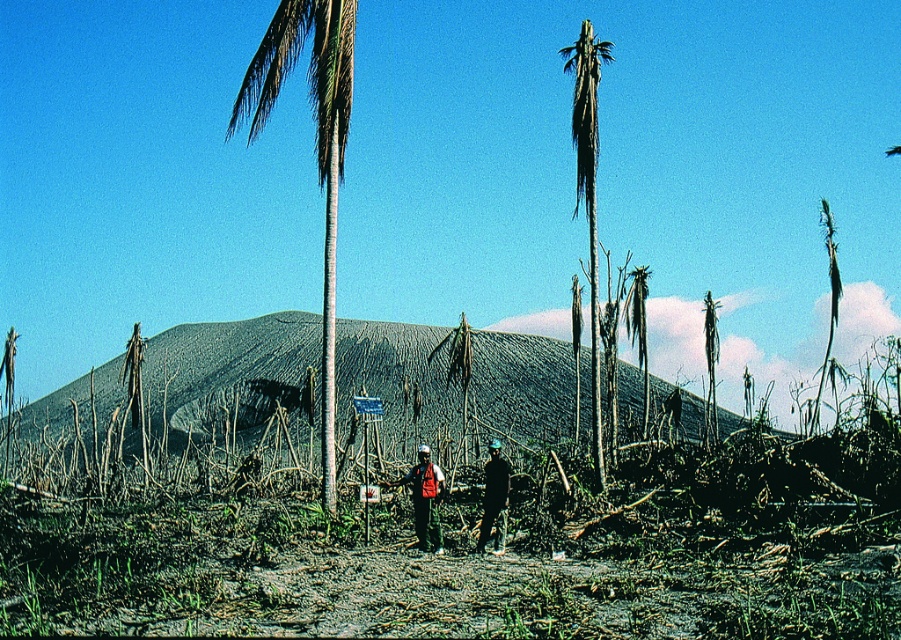
What do you see at coordinates (315, 145) in the screenshot?
I see `white smooth palm tree at center` at bounding box center [315, 145].

Is white smooth palm tree at center to the right of dark blue fabric at center from the viewer's perspective?

In fact, white smooth palm tree at center is to the left of dark blue fabric at center.

Who is more forward, (271, 40) or (487, 509)?

Point (487, 509) is more forward.

Identify the location of white smooth palm tree at center. (315, 145).

From the picture: Is red reflective vest at center in front of dark blue fabric at center?

No, red reflective vest at center is further to the viewer.

Between red reflective vest at center and dark blue fabric at center, which one has more height?

With more height is dark blue fabric at center.

Locate an element on the screen. red reflective vest at center is located at coordinates (425, 499).

Between green leafy palm tree at center and dark blue fabric at center, which one appears on the left side from the viewer's perspective?

From the viewer's perspective, dark blue fabric at center appears more on the left side.

Between green leafy palm tree at center and dark blue fabric at center, which one is positioned higher?

green leafy palm tree at center is higher up.

Between point (594, 461) and point (498, 532), which one is positioned behind?

Point (594, 461)

Identify the location of green leafy palm tree at center. The image size is (901, 640). (588, 192).